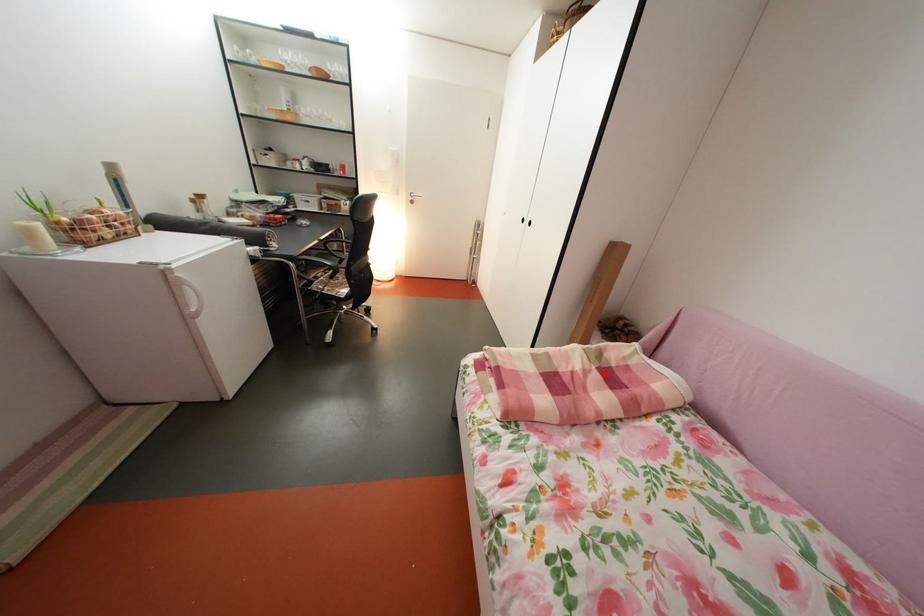
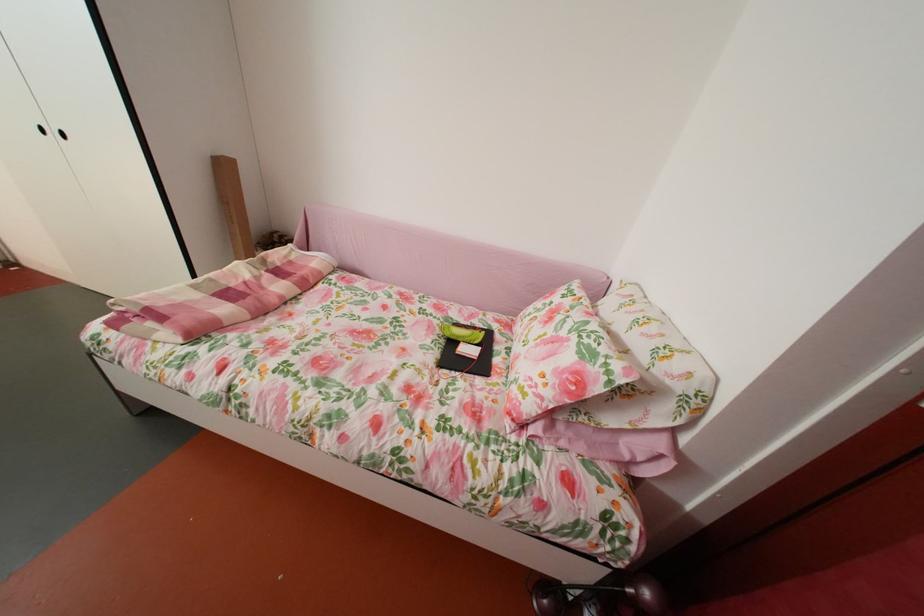
Question: I am providing you with two images of the same scene from different viewpoints. A red point is marked on the first image. Can you still see the location of the red point in image 2?

Choices:
 (A) Yes
 (B) No

Answer: (A)